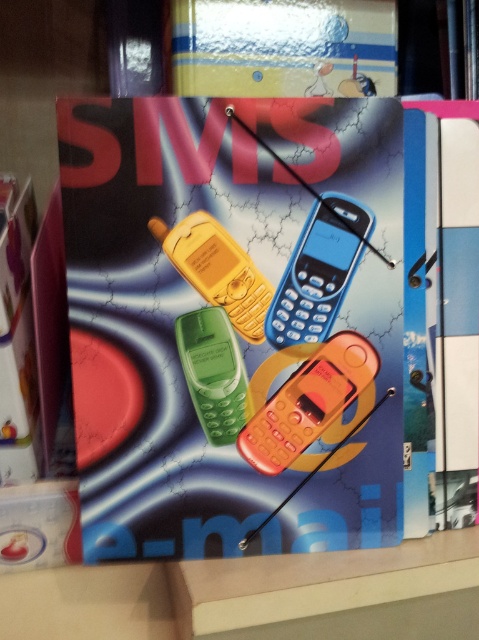
Is the position of orange matte phone at center less distant than that of blue plastic phone at center?

That is False.

In the scene shown: Can you confirm if orange matte phone at center is smaller than blue plastic phone at center?

No, orange matte phone at center is not smaller than blue plastic phone at center.

This screenshot has height=640, width=479. What are the coordinates of `orange matte phone at center` in the screenshot? It's located at (307, 401).

Locate an element on the screen. orange matte phone at center is located at coordinates (307, 401).

Between orange matte phone at center and yellow matte phone at center, which one appears on the left side from the viewer's perspective?

yellow matte phone at center

Can you confirm if orange matte phone at center is positioned to the left of yellow matte phone at center?

→ No, orange matte phone at center is not to the left of yellow matte phone at center.

Who is more forward, (250,440) or (262,278)?

Point (262,278) is in front.

Locate an element on the screen. orange matte phone at center is located at coordinates (307, 401).

Which is above, blue plastic phone at center or green matte phone at center?

blue plastic phone at center is above.

Can you confirm if blue plastic phone at center is positioned to the left of green matte phone at center?

No, blue plastic phone at center is not to the left of green matte phone at center.

The height and width of the screenshot is (640, 479). Identify the location of blue plastic phone at center. (318, 273).